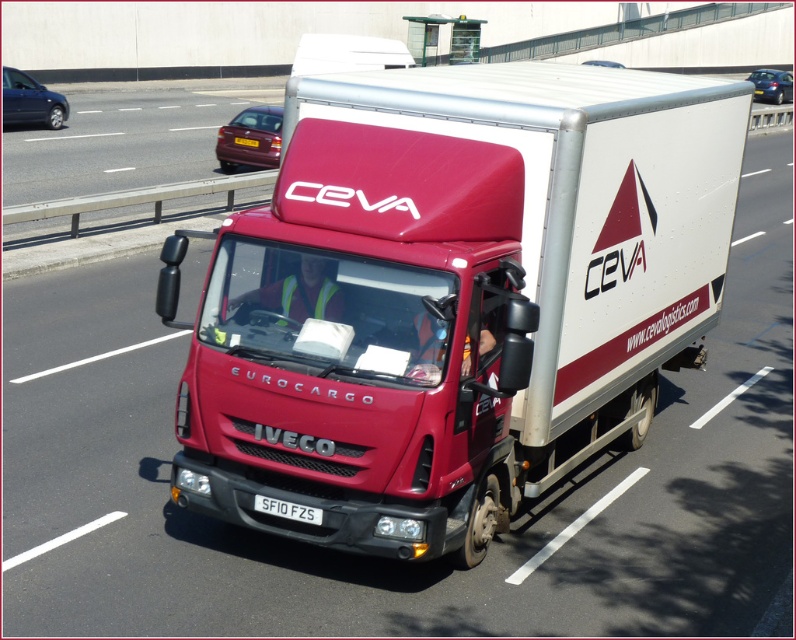
Is shiny maroon car at upper left behind white plastic license plate at center?

Yes.

Who is higher up, shiny maroon car at upper left or white plastic license plate at center?

shiny maroon car at upper left

Is point (260, 157) positioned behind point (256, 500)?

That is True.

Image resolution: width=796 pixels, height=640 pixels. Find the location of `shiny maroon car at upper left`. shiny maroon car at upper left is located at coordinates (250, 138).

Measure the distance between matte red trailer truck at center and camera.

matte red trailer truck at center is 4.97 meters away from camera.

Is matte red trailer truck at center further to camera compared to white plastic license plate at center?

No, it is not.

Describe the element at coordinates (455, 296) in the screenshot. The height and width of the screenshot is (640, 796). I see `matte red trailer truck at center` at that location.

The image size is (796, 640). In order to click on matte red trailer truck at center in this screenshot , I will do `click(455, 296)`.

Which of these two, matte red trailer truck at center or shiny maroon car at upper left, stands shorter?

Standing shorter between the two is shiny maroon car at upper left.

Is point (428, 532) farther from camera compared to point (279, 120)?

No, (428, 532) is in front of (279, 120).

This screenshot has width=796, height=640. What are the coordinates of `matte red trailer truck at center` in the screenshot? It's located at (455, 296).